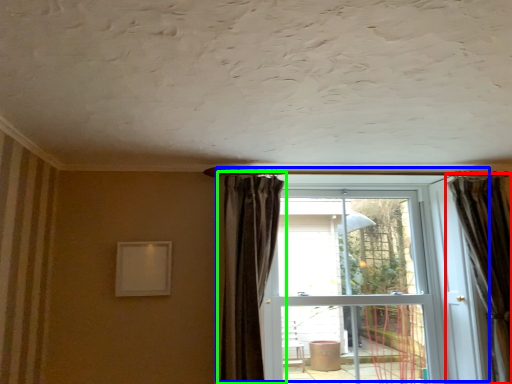
Question: Based on their relative distances, which object is farther from curtain (highlighted by a red box)? Choose from door (highlighted by a blue box) and curtain (highlighted by a green box).

Choices:
 (A) door
 (B) curtain

Answer: (B)